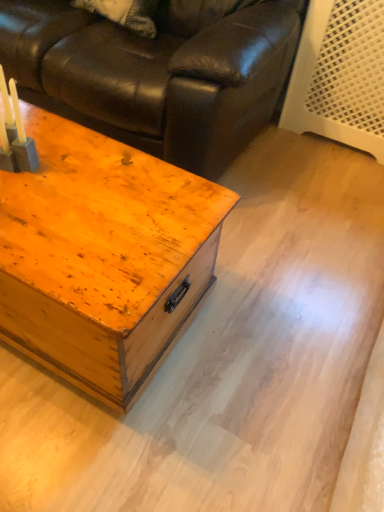
I want to click on vacant space to the right of matte gray candle holder at left, so click(81, 177).